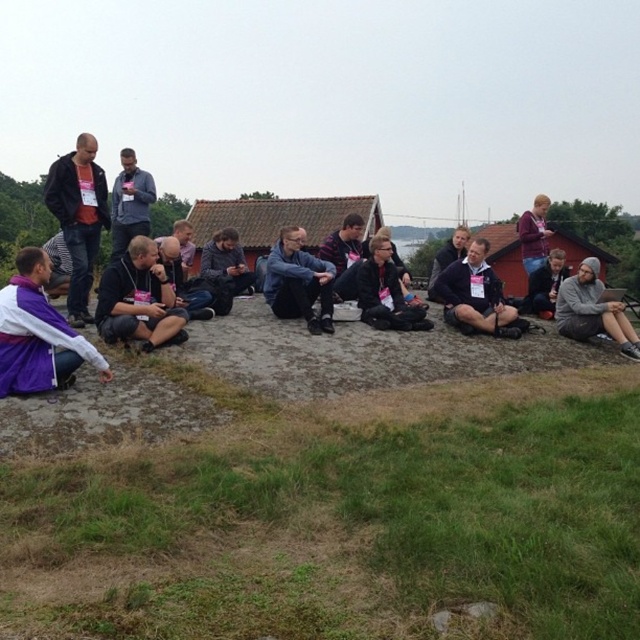
You are standing at the center of the image. Which direction should you look to see the dark blue shirt at upper left?

The dark blue shirt at upper left is located at the upper left direction from your current position at the center of the image.

You are planning to borrow a jacket from the group to stay warm. Both the blue denim jacket at center and the striped sweater at center are available. Which one would you choose based on size?

The blue denim jacket at center is larger in size than the striped sweater at center, so you should choose the blue denim jacket at center for better warmth and coverage.

You are a photographer trying to capture a group photo of the black fabric shirt at center and dark blue jacket at center. The camera you are using has a minimum focusing distance of 4 meters. Will you be able to take a clear photo of both subjects without moving the camera?

The distance between the black fabric shirt at center and dark blue jacket at center is 3.88 meters. Since the camera requires a minimum focusing distance of 4 meters, you are too close to capture both subjects clearly without moving the camera.